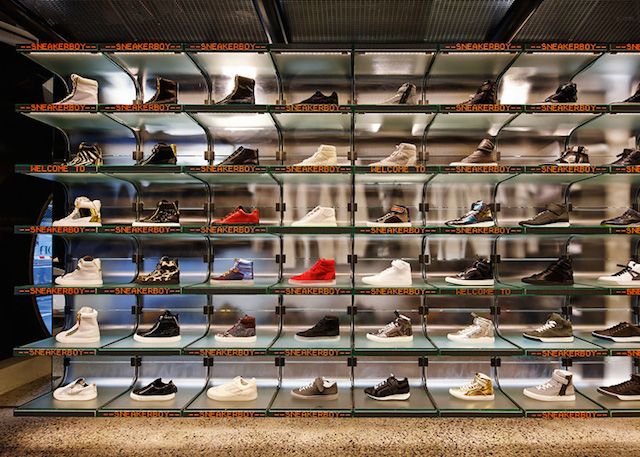
Where is `sneakers on bottom shelve`? sneakers on bottom shelve is located at coordinates (77, 392), (150, 391), (236, 387), (308, 389), (385, 389), (481, 387), (550, 385), (621, 389).